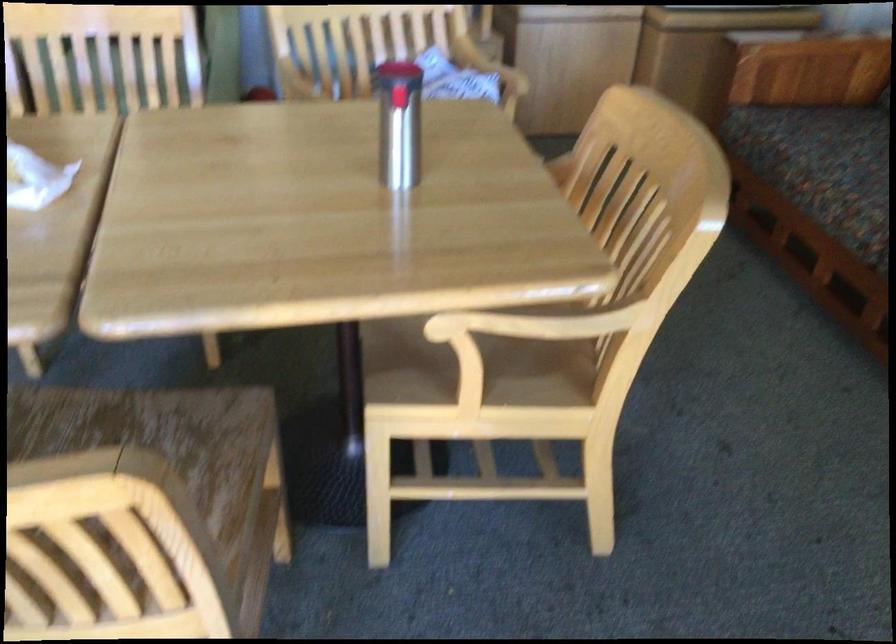
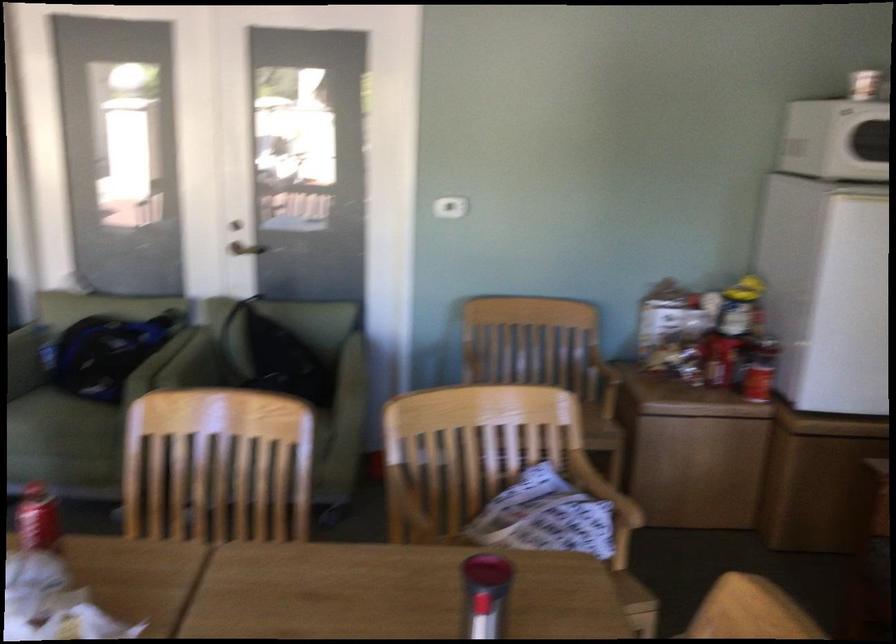
In the second image, find the point that corresponds to [308,135] in the first image.

(391, 592)